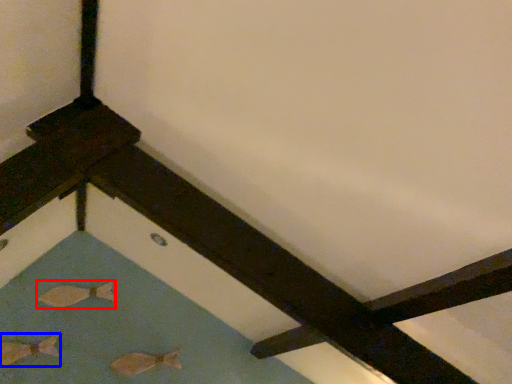
Question: Which point is further to the camera, fish (highlighted by a red box) or fish (highlighted by a blue box)?

Choices:
 (A) fish
 (B) fish

Answer: (A)